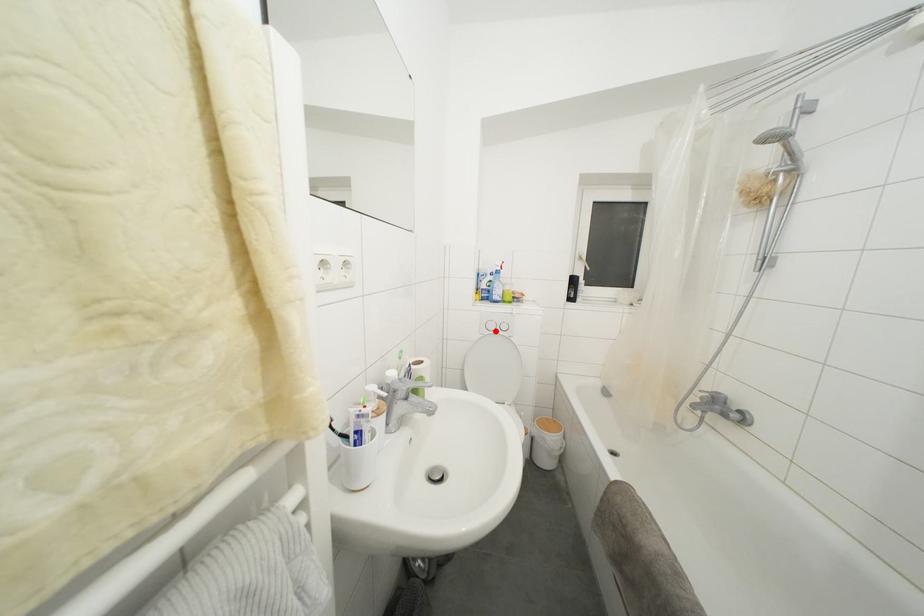
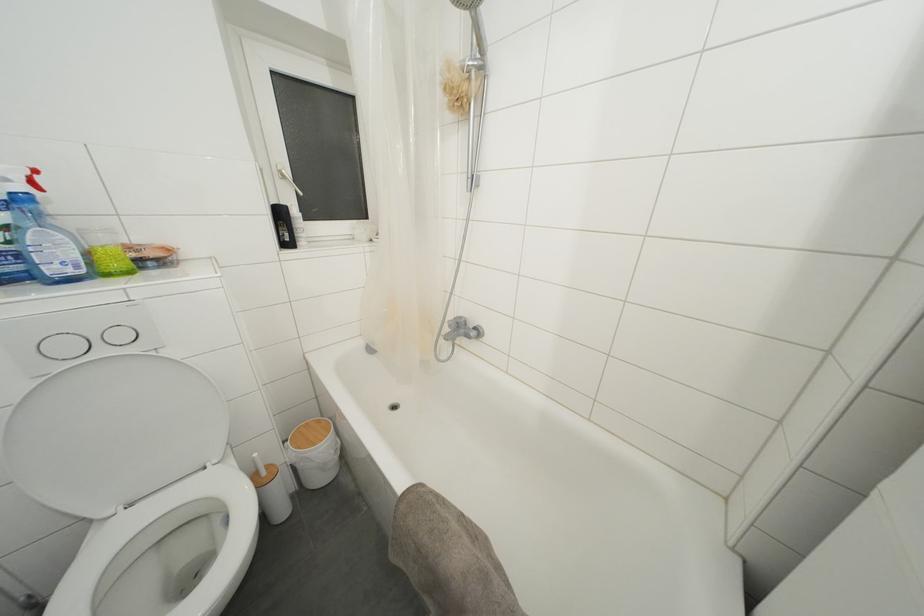
Question: I am providing you with two images of the same scene from different viewpoints. Given a red point in image1, look at the same physical point in image2. Is it:

Choices:
 (A) Closer to the viewpoint
 (B) Farther from the viewpoint

Answer: (B)